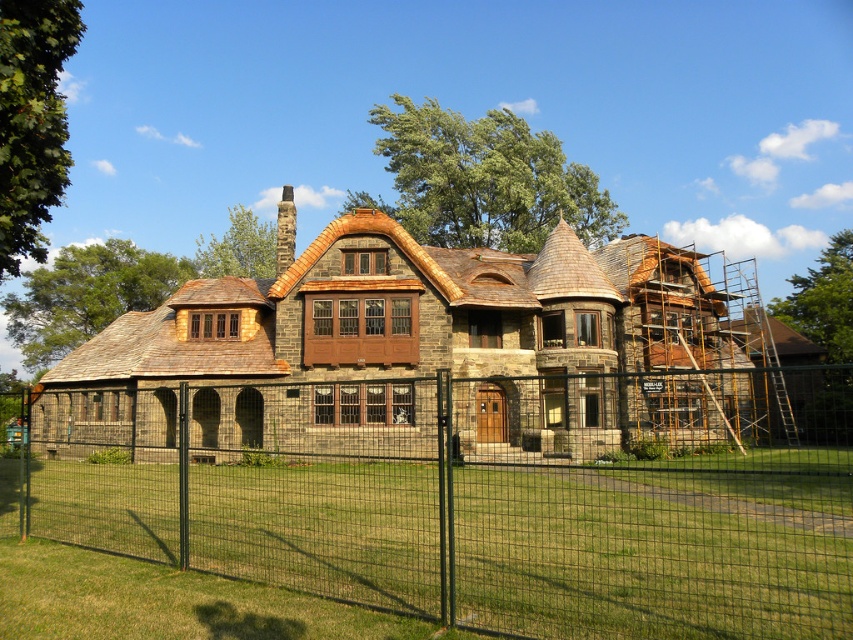
You are standing in front of the stone house at center and notice a green wire mesh fence at center. Based on the scene description, which object is positioned lower in the image?

The green wire mesh fence at center is positioned below the stone house at center, so it is lower in the image.